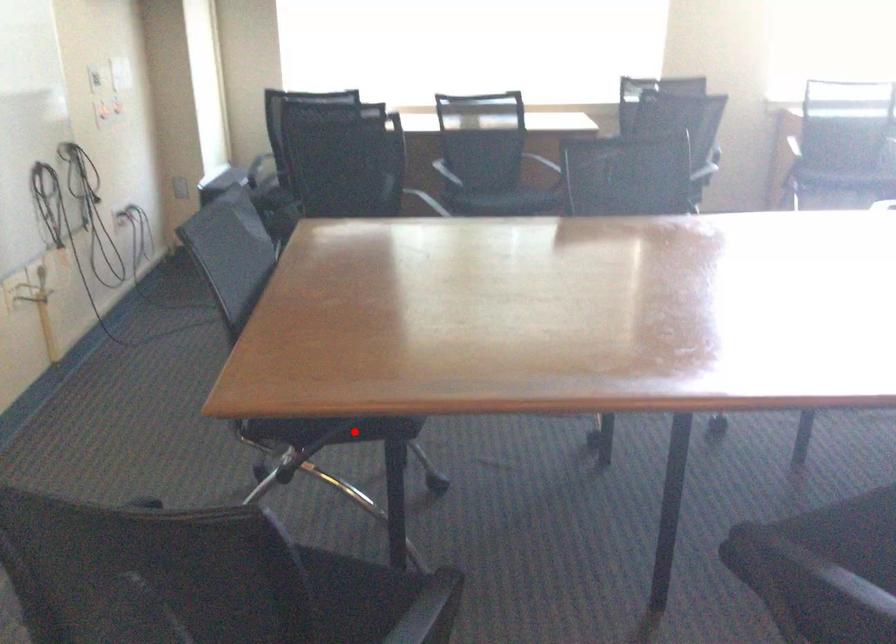
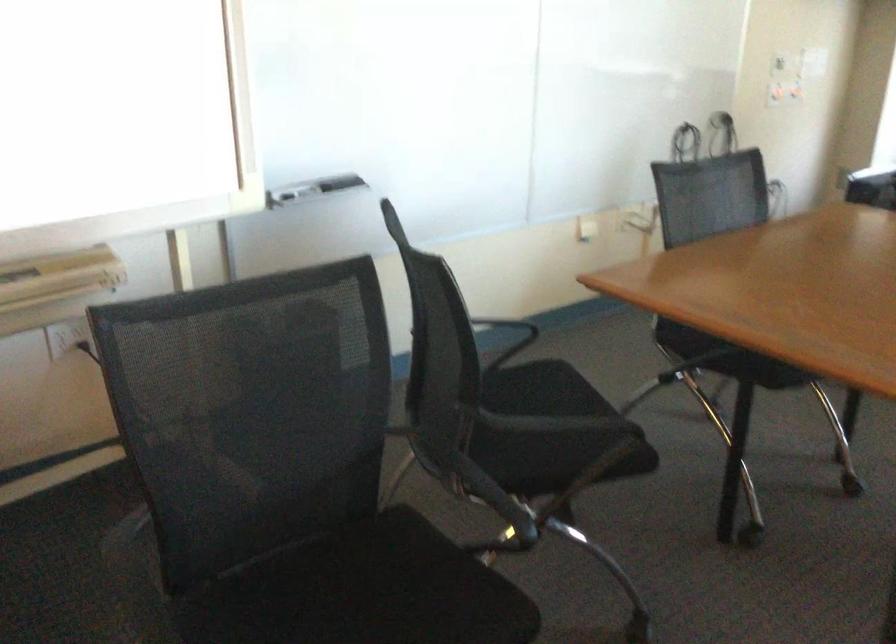
Find the pixel in the second image that matches the highlighted location in the first image.

(728, 357)